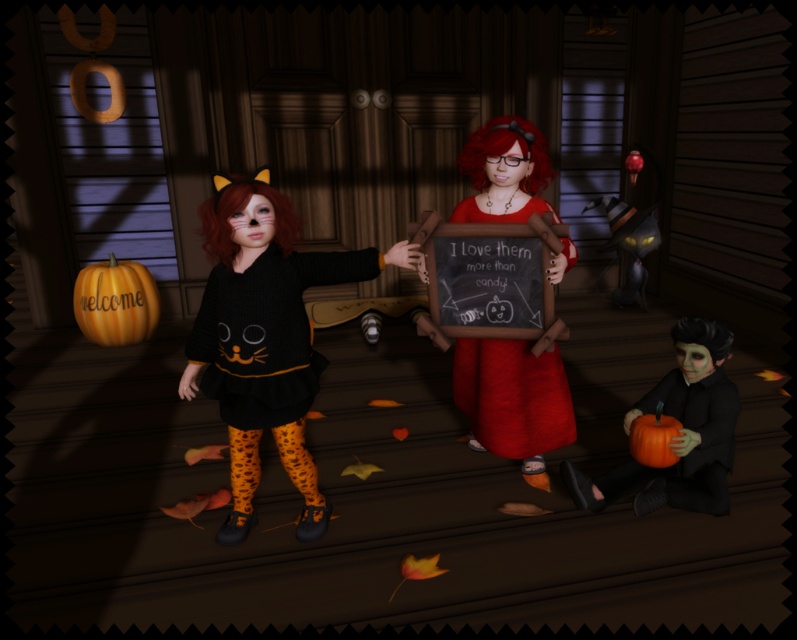
Question: Can you confirm if knitted/black dress at center is positioned to the right of matte black pumpkin at lower right?

Choices:
 (A) no
 (B) yes

Answer: (A)

Question: Which object appears farthest from the camera in this image?

Choices:
 (A) orange matte pumpkin at lower right
 (B) black knit dress at center
 (C) knitted/black dress at center

Answer: (A)

Question: Does black knit dress at center appear on the right side of orange matte pumpkin at lower right?

Choices:
 (A) yes
 (B) no

Answer: (B)

Question: Which is farther from the orange matte pumpkin at lower left?

Choices:
 (A) knitted/black dress at center
 (B) matte red dress at center

Answer: (B)

Question: Which object is the farthest from the matte black pumpkin at lower right?

Choices:
 (A) black knit dress at center
 (B) orange matte pumpkin at lower left
 (C) orange matte pumpkin at lower right

Answer: (B)

Question: Is knitted/black dress at center wider than matte black pumpkin at lower right?

Choices:
 (A) yes
 (B) no

Answer: (A)